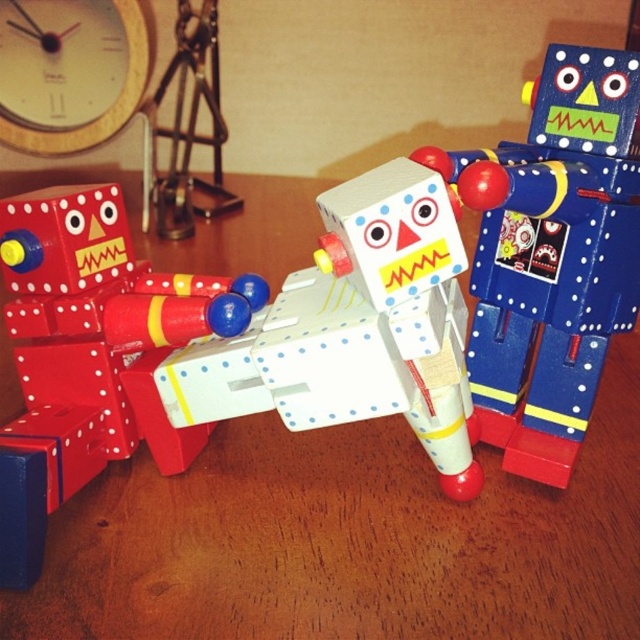
What are the coordinates of the blue matte robot at center?

The coordinates of the blue matte robot at center are at point (552, 253).

You are trying to place a small toy on the table. You have a blue matte robot at center and a white matte robot at center. Which robot should you place the toy on top of if you want the toy to be higher off the table?

The blue matte robot at center is much taller than the white matte robot at center, so placing the toy on top of the blue matte robot at center will make it higher off the table.

You are standing in front of the three robot figurines. There are two points marked in the image. Point A is at coordinates point (168,376) and Point B is at point (0,449). Which point is closer to you?

Point B at point (0,449) is closer to you because it is nearer to the camera than Point A at point (168,376).